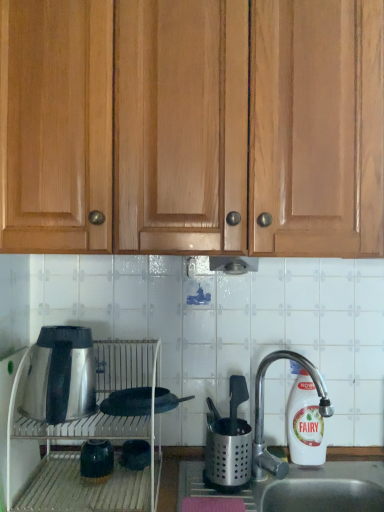
How much space does matte black pot at lower center, which is the 1th appliance in bottom-to-top order, occupy horizontally?

matte black pot at lower center, which is the 1th appliance in bottom-to-top order, is 4.61 inches in width.

Find the location of a particular element. satin silver exhaust hood at center is located at coordinates (233, 264).

Where is `white plastic bottle at right`? Image resolution: width=384 pixels, height=512 pixels. white plastic bottle at right is located at coordinates (305, 422).

The height and width of the screenshot is (512, 384). In order to click on black matte frying pan at center, the third appliance in the bottom-to-top sequence in this screenshot , I will do `click(128, 402)`.

At what (x,y) coordinates should I click in order to perform the action: click on the 1st appliance below the satin silver exhaust hood at center (from the image's perspective). Please return your answer as a coordinate pair (x, y). Looking at the image, I should click on (128, 402).

Is satin silver exhaust hood at center with black matte frying pan at center, the third appliance in the bottom-to-top sequence?

satin silver exhaust hood at center is not next to black matte frying pan at center, the third appliance in the bottom-to-top sequence, and they're not touching.

Does satin silver exhaust hood at center turn towards black matte frying pan at center, the 1th appliance in the top-to-bottom sequence?

No, satin silver exhaust hood at center is not oriented towards black matte frying pan at center, the 1th appliance in the top-to-bottom sequence.

In the scene shown: From the image's perspective, does satin silver exhaust hood at center appear higher than black matte frying pan at center, the third appliance in the bottom-to-top sequence?

Correct, satin silver exhaust hood at center appears higher than black matte frying pan at center, the third appliance in the bottom-to-top sequence, in the image.

Does satin silver oven at lower left appear on the right side of black matte frying pan at center, the 1th appliance in the top-to-bottom sequence?

Incorrect, satin silver oven at lower left is not on the right side of black matte frying pan at center, the 1th appliance in the top-to-bottom sequence.

From the image's perspective, is satin silver oven at lower left on top of black matte frying pan at center, the third appliance in the bottom-to-top sequence?

Actually, satin silver oven at lower left appears below black matte frying pan at center, the third appliance in the bottom-to-top sequence, in the image.

Is satin silver oven at lower left surrounding black matte frying pan at center, the third appliance in the bottom-to-top sequence?

Yes, black matte frying pan at center, the third appliance in the bottom-to-top sequence, is surrounded by satin silver oven at lower left.

Is point (10, 443) less distant than point (192, 395)?

Yes, it is.

Could you tell me if matte green vase at lower left, the 2th appliance when ordered from bottom to top, is facing light brown wood cabinets at upper center?

No, matte green vase at lower left, the 2th appliance when ordered from bottom to top, is not oriented towards light brown wood cabinets at upper center.

Is light brown wood cabinets at upper center surrounded by matte green vase at lower left, which appears as the second appliance when viewed from the top?

Definitely not — light brown wood cabinets at upper center is not inside matte green vase at lower left, which appears as the second appliance when viewed from the top.

From their relative heights in the image, would you say matte green vase at lower left, which appears as the second appliance when viewed from the top, is taller or shorter than light brown wood cabinets at upper center?

matte green vase at lower left, which appears as the second appliance when viewed from the top, is shorter than light brown wood cabinets at upper center.

This screenshot has width=384, height=512. What are the coordinates of `appliance that is the 2nd one when counting downward from the shiny metallic kettle at left (from the image's perspective)` in the screenshot? It's located at (96, 461).

Who is shorter, shiny metallic kettle at left or matte green vase at lower left, the 2th appliance when ordered from bottom to top?

matte green vase at lower left, the 2th appliance when ordered from bottom to top.

Is point (49, 353) farther from camera compared to point (109, 460)?

No, it is in front of (109, 460).

Does shiny metallic kettle at left have a greater width compared to matte green vase at lower left, which appears as the second appliance when viewed from the top?

Yes.

Considering the sizes of objects satin silver oven at lower left and satin silver exhaust hood at center in the image provided, who is thinner, satin silver oven at lower left or satin silver exhaust hood at center?

With smaller width is satin silver exhaust hood at center.

Visually, is satin silver oven at lower left positioned to the left or to the right of satin silver exhaust hood at center?

From the image, it's evident that satin silver oven at lower left is to the left of satin silver exhaust hood at center.

In the image, there is a satin silver oven at lower left. Where is `exhaust hood above it (from the image's perspective)`? The width and height of the screenshot is (384, 512). exhaust hood above it (from the image's perspective) is located at coordinates pos(233,264).

From the picture: Is satin silver oven at lower left positioned in front of satin silver exhaust hood at center?

Yes, the depth of satin silver oven at lower left is less than that of satin silver exhaust hood at center.

Is silver metallic faucet at right turned away from black matte frying pan at center, the third appliance in the bottom-to-top sequence?

No, black matte frying pan at center, the third appliance in the bottom-to-top sequence, is not at the back of silver metallic faucet at right.

From the image's perspective, is silver metallic faucet at right under black matte frying pan at center, the third appliance in the bottom-to-top sequence?

Yes, from the image's perspective, silver metallic faucet at right is below black matte frying pan at center, the third appliance in the bottom-to-top sequence.

In the scene shown: Do you think silver metallic faucet at right is within black matte frying pan at center, the third appliance in the bottom-to-top sequence, or outside of it?

silver metallic faucet at right is located beyond the bounds of black matte frying pan at center, the third appliance in the bottom-to-top sequence.

From their relative heights in the image, would you say light brown wood cabinets at upper center is taller or shorter than satin silver exhaust hood at center?

Considering their sizes, light brown wood cabinets at upper center has more height than satin silver exhaust hood at center.

Does point (59, 169) lie behind point (222, 263)?

No, (59, 169) is in front of (222, 263).

Is light brown wood cabinets at upper center turned away from satin silver exhaust hood at center?

light brown wood cabinets at upper center does not have its back to satin silver exhaust hood at center.

Can you tell me how much light brown wood cabinets at upper center and satin silver exhaust hood at center differ in facing direction?

They differ by 0.434 degrees in their facing directions.

The width and height of the screenshot is (384, 512). I want to click on exhaust hood behind the black matte frying pan at center, the 1th appliance in the top-to-bottom sequence, so click(233, 264).

Where is `oven below the black matte frying pan at center, the third appliance in the bottom-to-top sequence (from the image's perspective)`? The width and height of the screenshot is (384, 512). oven below the black matte frying pan at center, the third appliance in the bottom-to-top sequence (from the image's perspective) is located at coordinates (92, 438).

Which object lies further to the anchor point silver metallic faucet at right, shiny metallic kettle at left or matte green vase at lower left, which appears as the second appliance when viewed from the top?

shiny metallic kettle at left is positioned further to the anchor silver metallic faucet at right.

Based on their spatial positions, is matte black pot at lower center, which is the 1th appliance in bottom-to-top order, or shiny metallic kettle at left further from black matte frying pan at center, the third appliance in the bottom-to-top sequence?

shiny metallic kettle at left is positioned further to the anchor black matte frying pan at center, the third appliance in the bottom-to-top sequence.

Based on their spatial positions, is white plastic bottle at right or matte black pot at lower center, positioned as the third appliance in top-to-bottom order, closer to black matte frying pan at center, the 1th appliance in the top-to-bottom sequence?

matte black pot at lower center, positioned as the third appliance in top-to-bottom order, is closer to black matte frying pan at center, the 1th appliance in the top-to-bottom sequence.

From the image, which object appears to be nearer to white plastic bottle at right, light brown wood cabinets at upper center or silver metallic faucet at right?

silver metallic faucet at right is closer to white plastic bottle at right.

Considering their positions, is silver metallic faucet at right positioned closer to matte green vase at lower left, which appears as the second appliance when viewed from the top, than satin silver exhaust hood at center?

silver metallic faucet at right is positioned closer to the anchor matte green vase at lower left, which appears as the second appliance when viewed from the top.

Based on their spatial positions, is silver metallic faucet at right or satin silver exhaust hood at center further from satin silver oven at lower left?

satin silver exhaust hood at center is further to satin silver oven at lower left.

Considering their positions, is matte black pot at lower center, positioned as the third appliance in top-to-bottom order, positioned further to black matte frying pan at center, the third appliance in the bottom-to-top sequence, than matte green vase at lower left, the 2th appliance when ordered from bottom to top?

Among the two, matte green vase at lower left, the 2th appliance when ordered from bottom to top, is located further to black matte frying pan at center, the third appliance in the bottom-to-top sequence.

From the image, which object appears to be nearer to matte black pot at lower center, which is the 1th appliance in bottom-to-top order, silver metallic faucet at right or satin silver exhaust hood at center?

Based on the image, silver metallic faucet at right appears to be nearer to matte black pot at lower center, which is the 1th appliance in bottom-to-top order.

Where is `appliance between light brown wood cabinets at upper center and matte green vase at lower left, which appears as the second appliance when viewed from the top, in the vertical direction`? This screenshot has width=384, height=512. appliance between light brown wood cabinets at upper center and matte green vase at lower left, which appears as the second appliance when viewed from the top, in the vertical direction is located at coordinates (128, 402).

Locate an element on the screen. oven located between matte green vase at lower left, the 2th appliance when ordered from bottom to top, and silver metallic faucet at right in the left-right direction is located at coordinates (92, 438).

Where is `appliance between light brown wood cabinets at upper center and white plastic bottle at right in the vertical direction`? appliance between light brown wood cabinets at upper center and white plastic bottle at right in the vertical direction is located at coordinates (128, 402).

You are a GUI agent. You are given a task and a screenshot of the screen. Output one action in this format:
    pyautogui.click(x=<x>, y=<y>)
    Task: Click on the cleaning product between light brown wood cabinets at upper center and matte black pot at lower center, positioned as the third appliance in top-to-bottom order, from top to bottom
    This screenshot has height=512, width=384.
    Given the screenshot: What is the action you would take?
    pyautogui.click(x=305, y=422)